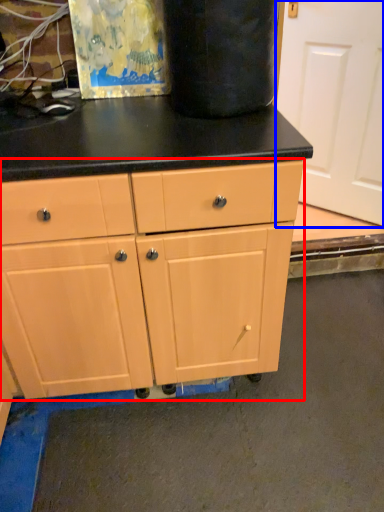
Question: Among these objects, which one is nearest to the camera, chest of drawers (highlighted by a red box) or screen door (highlighted by a blue box)?

Choices:
 (A) chest of drawers
 (B) screen door

Answer: (A)